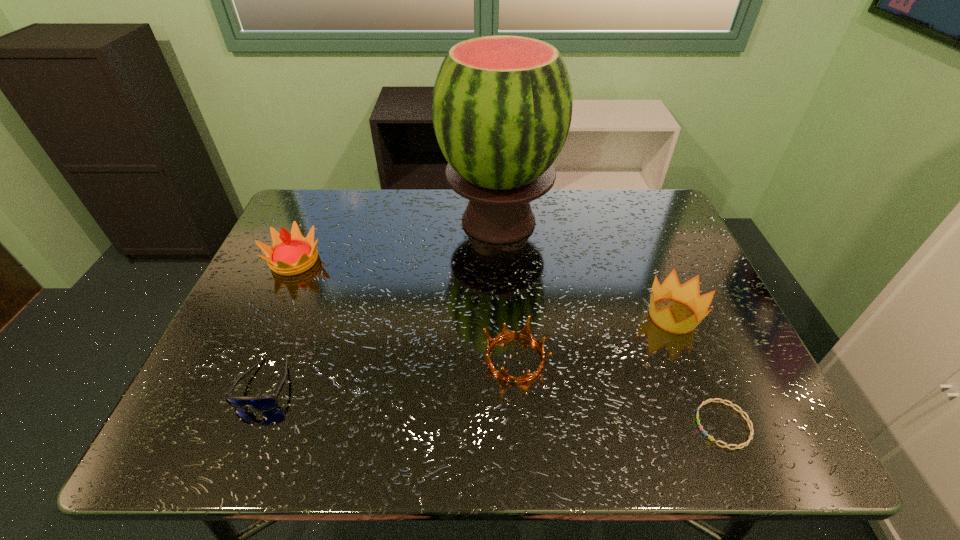
Where is `watermelon`? This screenshot has height=540, width=960. watermelon is located at coordinates (502, 105).

Locate an element on the screen. The width and height of the screenshot is (960, 540). the leftmost crown is located at coordinates (291, 254).

Find the location of a particular element. This screenshot has width=960, height=540. the farthest crown is located at coordinates [x=291, y=254].

Locate an element on the screen. The width and height of the screenshot is (960, 540). the second tallest crown is located at coordinates coord(688,293).

I want to click on the fourth shortest object, so click(x=688, y=293).

What are the coordinates of `the shortest crown` in the screenshot? It's located at (525, 333).

The width and height of the screenshot is (960, 540). Identify the location of the second shortest object. (262, 403).

This screenshot has width=960, height=540. I want to click on the shortest object, so click(747, 419).

You are a GUI agent. You are given a task and a screenshot of the screen. Output one action in this format:
    pyautogui.click(x=<x>, y=<y>)
    Task: Click on the free region located 0.240m on the left of the tallest object
    
    Given the screenshot: What is the action you would take?
    pyautogui.click(x=359, y=221)

I want to click on blank space located on the right of the tallest crown, so click(x=388, y=261).